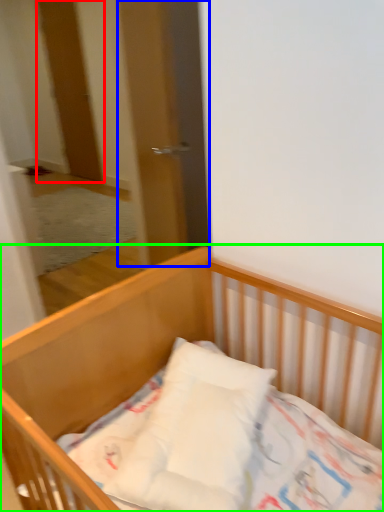
Question: Which object is the farthest from door (highlighted by a red box)? Choose among these: screen door (highlighted by a blue box) or bed (highlighted by a green box).

Choices:
 (A) screen door
 (B) bed

Answer: (B)